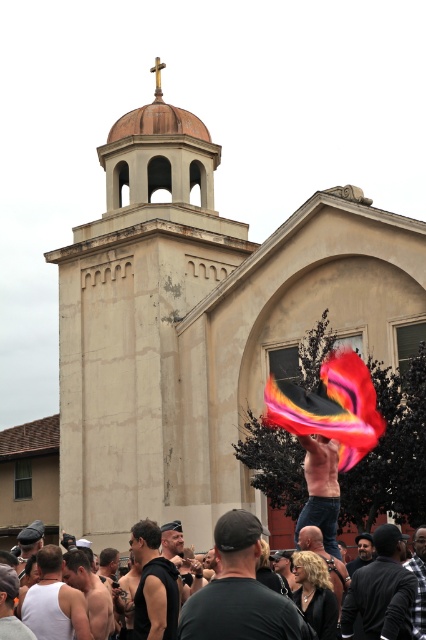
Question: Which of these objects is positioned farthest from the shiny silver tank top at lower left?

Choices:
 (A) matte black cap at lower left
 (B) beige concrete church at center
 (C) shiny metallic hat at center

Answer: (B)

Question: Can you confirm if beige concrete church at center is thinner than black cap at center?

Choices:
 (A) yes
 (B) no

Answer: (B)

Question: Can you confirm if beige concrete church at center is positioned to the right of white tank top at lower left?

Choices:
 (A) no
 (B) yes

Answer: (B)

Question: Which object is closer to the camera taking this photo?

Choices:
 (A) matte black cap at lower left
 (B) black leather jacket at center
 (C) shiny metallic hat at center
 (D) shiny silver tank top at lower left

Answer: (B)

Question: Which of the following is the farthest from the observer?

Choices:
 (A) beige concrete church at center
 (B) white tank top at lower left
 (C) black leather jacket at center

Answer: (A)

Question: Is black matte shirt at center closer to the viewer compared to shiny black jacket at center?

Choices:
 (A) no
 (B) yes

Answer: (B)